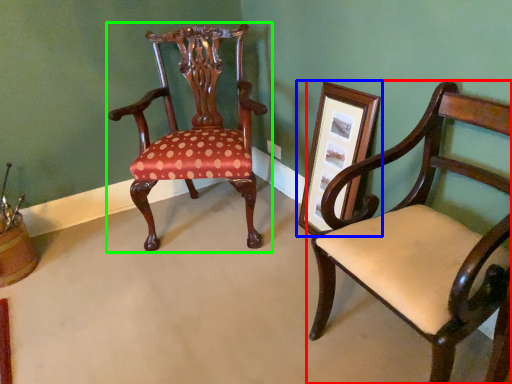
Question: Estimate the real-world distances between objects in this image. Which object is farther from chair (highlighted by a red box), picture frame (highlighted by a blue box) or chair (highlighted by a green box)?

Choices:
 (A) picture frame
 (B) chair

Answer: (B)